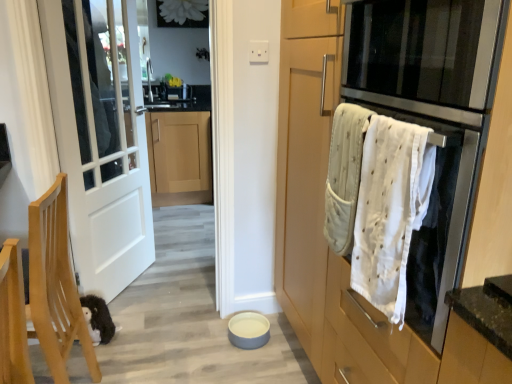
Question: Is stainless steel oven at right, which is the first oven from top to bottom, in contact with wooden chair at lower left?

Choices:
 (A) yes
 (B) no

Answer: (B)

Question: Can we say stainless steel oven at right, which is the 2th oven in bottom-to-top order, lies outside wooden chair at lower left?

Choices:
 (A) yes
 (B) no

Answer: (A)

Question: Is stainless steel oven at right, which is the 2th oven in bottom-to-top order, to the left of wooden chair at lower left from the viewer's perspective?

Choices:
 (A) no
 (B) yes

Answer: (A)

Question: From the image's perspective, is stainless steel oven at right, which is the 2th oven in bottom-to-top order, over wooden chair at lower left?

Choices:
 (A) no
 (B) yes

Answer: (B)

Question: Considering the relative sizes of stainless steel oven at right, which is the 2th oven in bottom-to-top order, and wooden chair at lower left in the image provided, is stainless steel oven at right, which is the 2th oven in bottom-to-top order, taller than wooden chair at lower left?

Choices:
 (A) no
 (B) yes

Answer: (A)

Question: Is wooden chair at lower left at the back of stainless steel oven at right, which is the first oven from top to bottom?

Choices:
 (A) no
 (B) yes

Answer: (A)

Question: From the image's perspective, does matte wood cabinet at right, which is the 1th cabinetry from right to left, appear lower than white textured towel at right?

Choices:
 (A) yes
 (B) no

Answer: (A)

Question: Would you say matte wood cabinet at right, which appears as the second cabinetry when viewed from the left, is outside white textured towel at right?

Choices:
 (A) yes
 (B) no

Answer: (A)

Question: Is matte wood cabinet at right, which is the 1th cabinetry from right to left, next to white textured towel at right?

Choices:
 (A) yes
 (B) no

Answer: (B)

Question: Considering the relative sizes of matte wood cabinet at right, positioned as the first cabinetry in front-to-back order, and white textured towel at right in the image provided, is matte wood cabinet at right, positioned as the first cabinetry in front-to-back order, bigger than white textured towel at right?

Choices:
 (A) no
 (B) yes

Answer: (B)

Question: Is matte wood cabinet at right, which appears as the 2th cabinetry when viewed from the back, oriented away from white textured towel at right?

Choices:
 (A) no
 (B) yes

Answer: (B)

Question: Does matte wood cabinet at right, which is the 1th cabinetry from right to left, come behind white textured towel at right?

Choices:
 (A) yes
 (B) no

Answer: (B)

Question: Can you confirm if white glossy sink at upper center is bigger than light wood cabinet at center, arranged as the first cabinetry when viewed from the left?

Choices:
 (A) yes
 (B) no

Answer: (B)